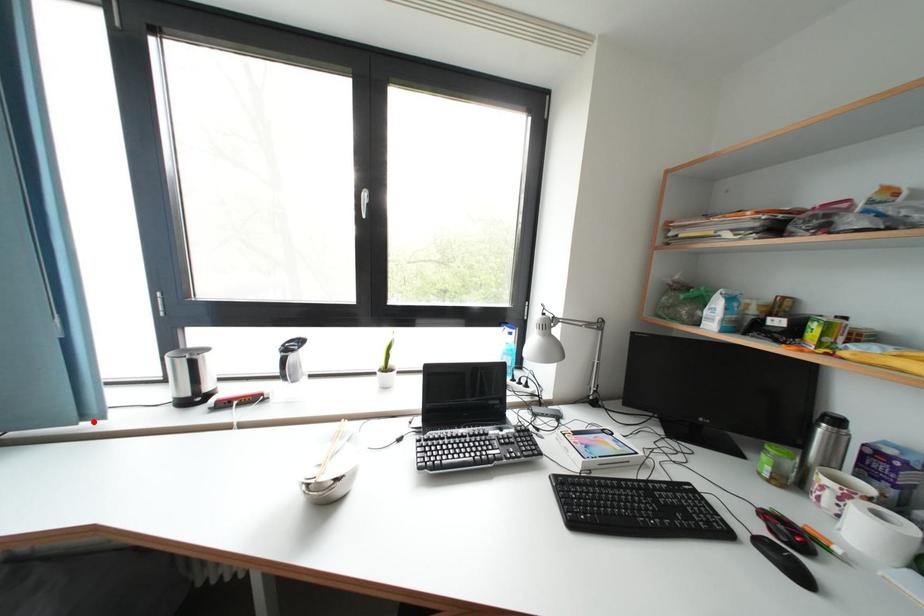
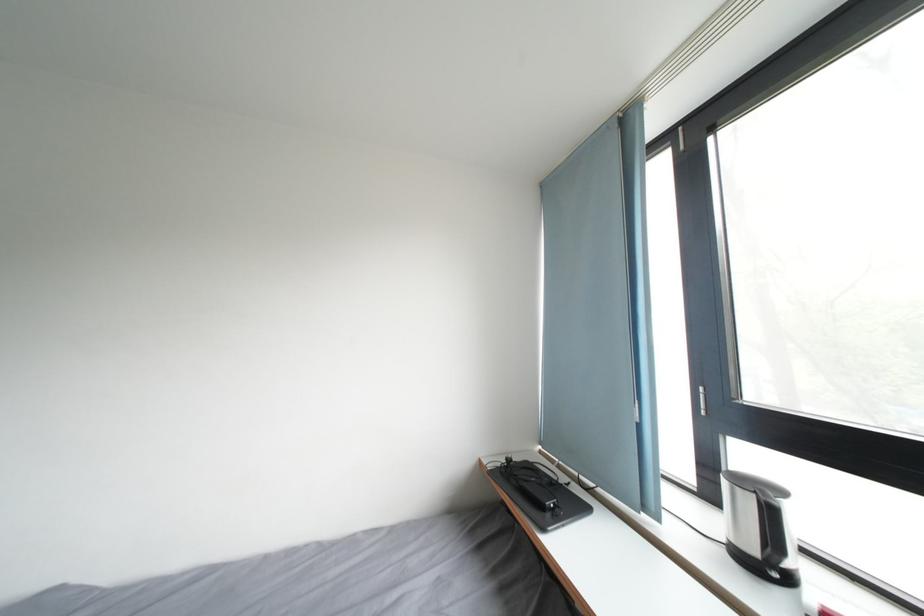
Where in the second image is the point corresponding to the highlighted location from the first image?

(651, 514)